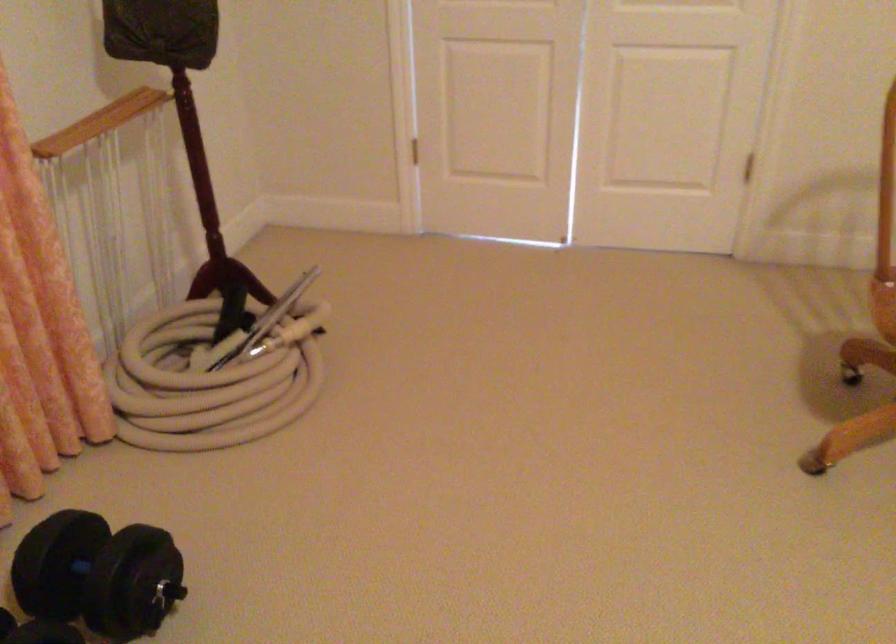
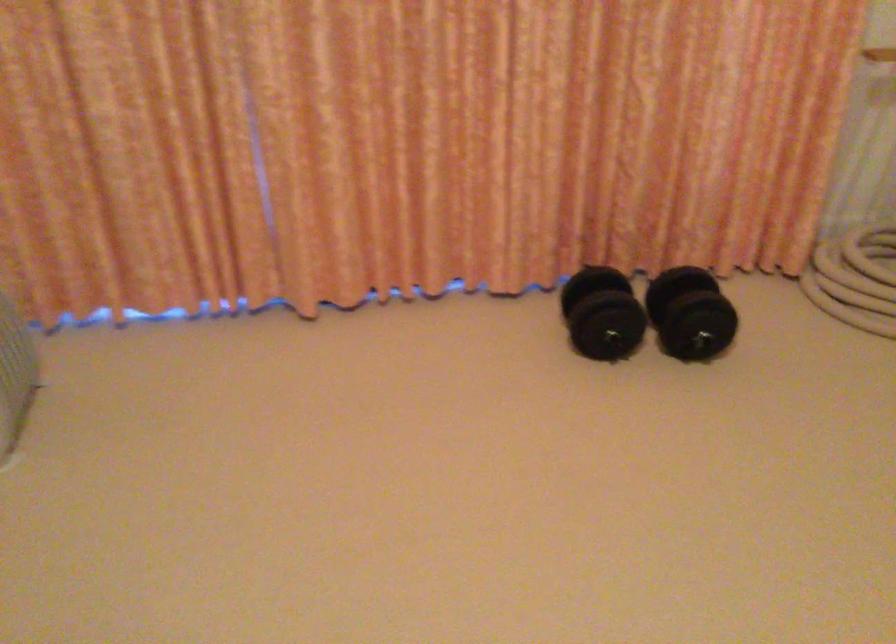
Find the pixel in the second image that matches point (90, 574) in the first image.

(690, 313)